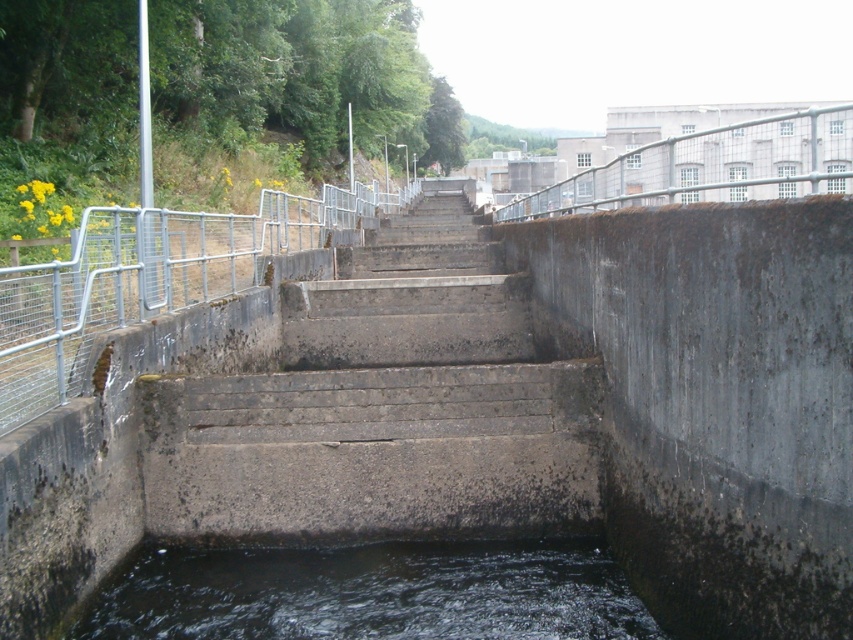
Question: Which point is closer to the camera taking this photo?

Choices:
 (A) (579, 156)
 (B) (158, 630)
 (C) (170, 472)

Answer: (B)

Question: Among these objects, which one is farthest from the camera?

Choices:
 (A) metallic gray rail at upper right
 (B) concrete stairs at center

Answer: (B)

Question: Does dark gray water at bottom center appear on the left side of metallic gray rail at upper right?

Choices:
 (A) no
 (B) yes

Answer: (B)

Question: Can you confirm if dark gray water at bottom center is smaller than metallic gray rail at upper right?

Choices:
 (A) yes
 (B) no

Answer: (A)

Question: Is dark gray water at bottom center above metallic gray rail at upper right?

Choices:
 (A) no
 (B) yes

Answer: (A)

Question: Which point is farther from the camera taking this photo?

Choices:
 (A) (450, 561)
 (B) (305, 481)
 (C) (653, 132)

Answer: (C)